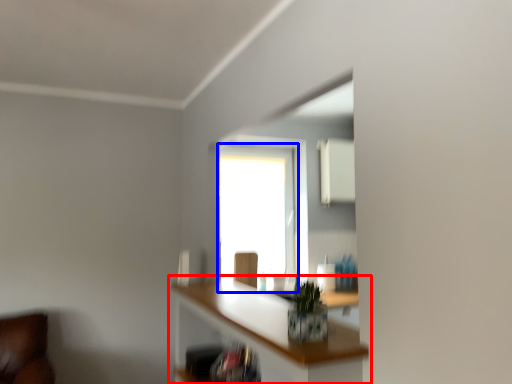
Question: Which object appears closest to the camera in this image, shelf (highlighted by a red box) or window (highlighted by a blue box)?

Choices:
 (A) shelf
 (B) window

Answer: (A)